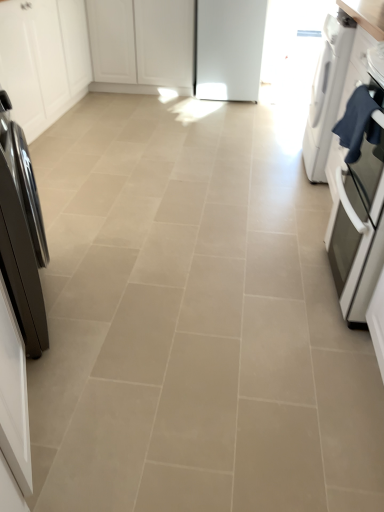
Question: In the image, is white matte cabinet at upper left, acting as the first cabinetry starting from the left, positioned in front of or behind white matte cabinet at center, the second cabinetry viewed from the left?

Choices:
 (A) behind
 (B) front

Answer: (B)

Question: From the image's perspective, relative to white matte cabinet at center, the first cabinetry when ordered from right to left, is white matte cabinet at upper left, acting as the first cabinetry starting from the left, above or below?

Choices:
 (A) below
 (B) above

Answer: (A)

Question: Considering the real-world distances, which object is closest to the shiny black refrigerator at left, marked as the 2th home appliance in a right-to-left arrangement?

Choices:
 (A) matte stainless steel oven at right
 (B) white matte cabinet at center, the first cabinetry when ordered from right to left
 (C) dark blue fabric at right
 (D) white matte cabinet at upper left, acting as the first cabinetry starting from the left
 (E) white glossy dryer at right, the 1th home appliance from the back

Answer: (C)

Question: Based on their relative distances, which object is nearer to the matte stainless steel oven at right?

Choices:
 (A) dark blue fabric at right
 (B) shiny black refrigerator at left, the 1th home appliance from the left
 (C) white glossy dryer at right, positioned as the 1th home appliance in right-to-left order
 (D) white matte cabinet at upper left, the 2th cabinetry from the right
 (E) white matte cabinet at center, the second cabinetry viewed from the left

Answer: (A)